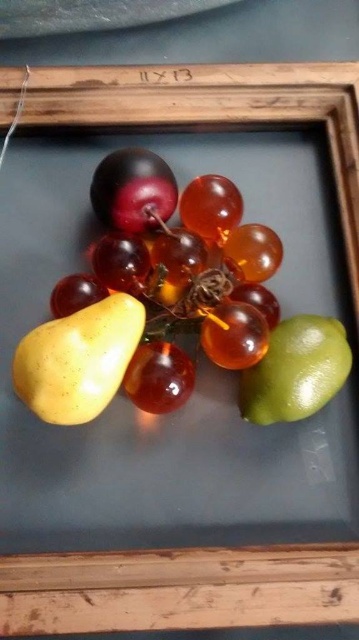
Image resolution: width=359 pixels, height=640 pixels. What do you see at coordinates (184, 273) in the screenshot?
I see `translucent amber grapes at center` at bounding box center [184, 273].

Find the location of a particular element. This screenshot has height=640, width=359. translucent amber grapes at center is located at coordinates (184, 273).

Identify the location of translucent amber grapes at center. (184, 273).

Does translucent amber grapes at center have a greater width compared to green matte lime at lower right?

Indeed, translucent amber grapes at center has a greater width compared to green matte lime at lower right.

Is translucent amber grapes at center thinner than green matte lime at lower right?

Incorrect, translucent amber grapes at center's width is not less than green matte lime at lower right's.

The height and width of the screenshot is (640, 359). What do you see at coordinates (184, 273) in the screenshot?
I see `translucent amber grapes at center` at bounding box center [184, 273].

This screenshot has width=359, height=640. What are the coordinates of `translucent amber grapes at center` in the screenshot? It's located at (184, 273).

Does point (34, 349) come behind point (330, 332)?

No, it is not.

Can you confirm if yellow matte pear at center-left is positioned to the left of green matte lime at lower right?

Correct, you'll find yellow matte pear at center-left to the left of green matte lime at lower right.

Between point (28, 339) and point (314, 378), which one is positioned behind?

Point (314, 378)

Identify the location of yellow matte pear at center-left. (77, 358).